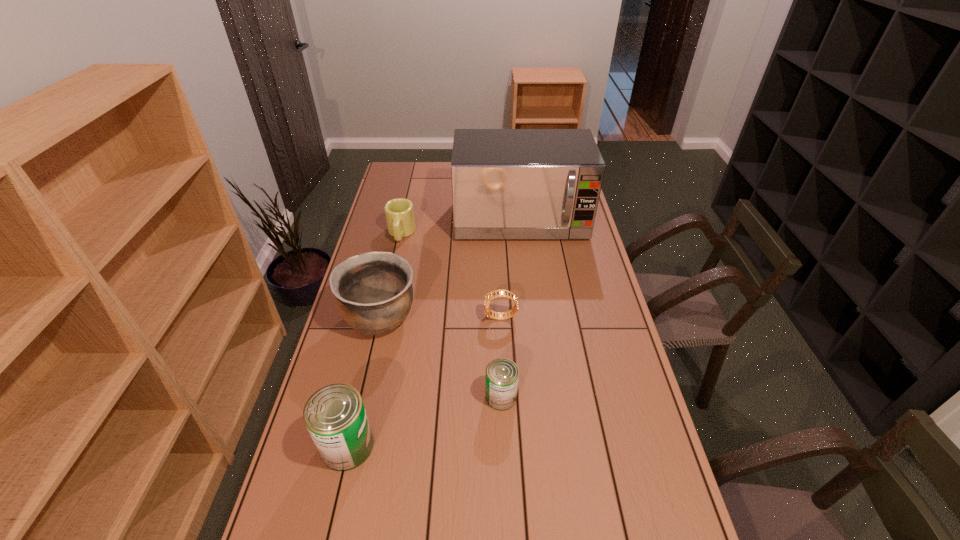
Locate an element on the screen. This screenshot has height=540, width=960. the nearer can is located at coordinates (335, 416).

Find the location of a particular element. the taller can is located at coordinates (335, 416).

Identify the location of the right can. (501, 385).

Identify the location of the second nearest object. This screenshot has width=960, height=540. (501, 385).

Where is `watch`? watch is located at coordinates pyautogui.click(x=488, y=297).

Locate an element on the screen. the tallest object is located at coordinates [506, 183].

You are a GUI agent. You are given a task and a screenshot of the screen. Output one action in this format:
    pyautogui.click(x=<x>, y=<y>)
    Task: Click on the mug
    The image size is (960, 540).
    Given the screenshot: What is the action you would take?
    pyautogui.click(x=399, y=212)

The width and height of the screenshot is (960, 540). What are the coordinates of `pottery` in the screenshot? It's located at 374,293.

This screenshot has width=960, height=540. What are the coordinates of `vacant space located on the right of the nearest object` in the screenshot? It's located at (408, 446).

This screenshot has height=540, width=960. I want to click on free spot located on the front of the shorter can, so click(503, 441).